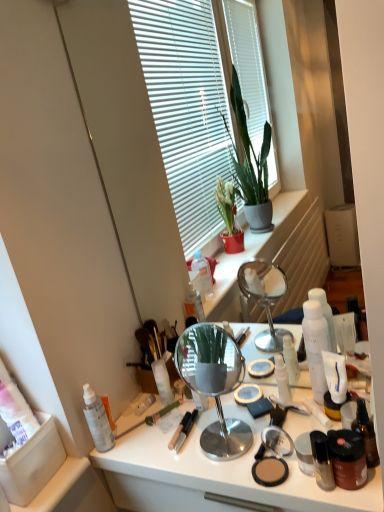
Image resolution: width=384 pixels, height=512 pixels. What are the coordinates of `blank area to the left of white matte lotion at right, the fifth toiletry positioned from the left` in the screenshot? It's located at (258, 414).